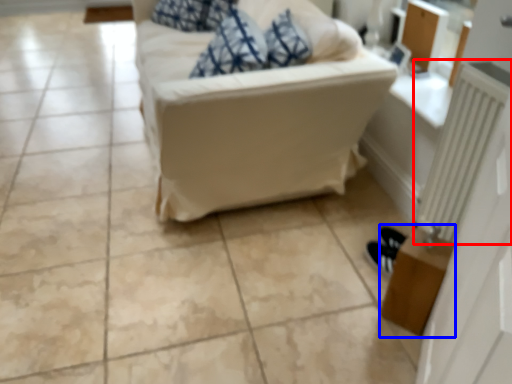
Question: Which of the following is the closest to the observer, radiator (highlighted by a red box) or table (highlighted by a blue box)?

Choices:
 (A) radiator
 (B) table

Answer: (A)